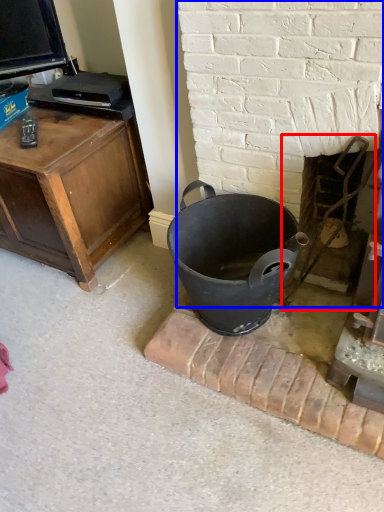
Question: Which object is closer to the camera taking this photo, fireplace (highlighted by a red box) or fireplace (highlighted by a blue box)?

Choices:
 (A) fireplace
 (B) fireplace

Answer: (B)